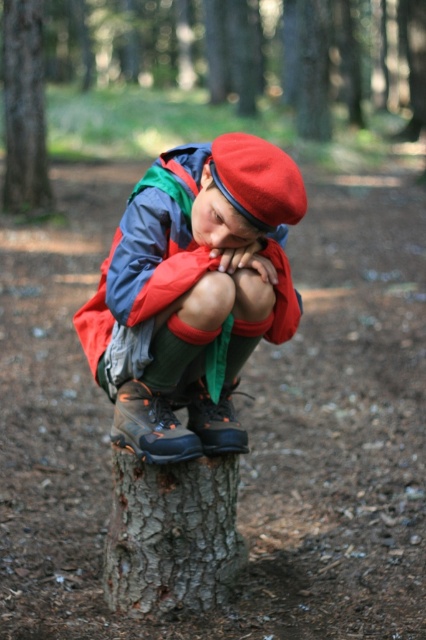
Question: Is matte red beret at center wider than gray rough bark tree trunk at center?

Choices:
 (A) yes
 (B) no

Answer: (A)

Question: Which point is farther to the camera?

Choices:
 (A) (11, 77)
 (B) (244, 156)
 (C) (256, 208)

Answer: (A)

Question: Is matte red beret at center to the left of gray rough bark tree trunk at center from the viewer's perspective?

Choices:
 (A) yes
 (B) no

Answer: (B)

Question: Which object appears closest to the camera in this image?

Choices:
 (A) red felt beret at center
 (B) gray rough bark tree trunk at center
 (C) brown rough tree stump at center

Answer: (A)

Question: Which point appears farthest from the camera in this image?

Choices:
 (A) (261, 228)
 (B) (26, 60)
 (C) (183, 38)
 (D) (137, 474)

Answer: (C)

Question: Can you confirm if gray rough bark tree trunk at center is positioned below brown rough tree trunk at left?

Choices:
 (A) yes
 (B) no

Answer: (A)